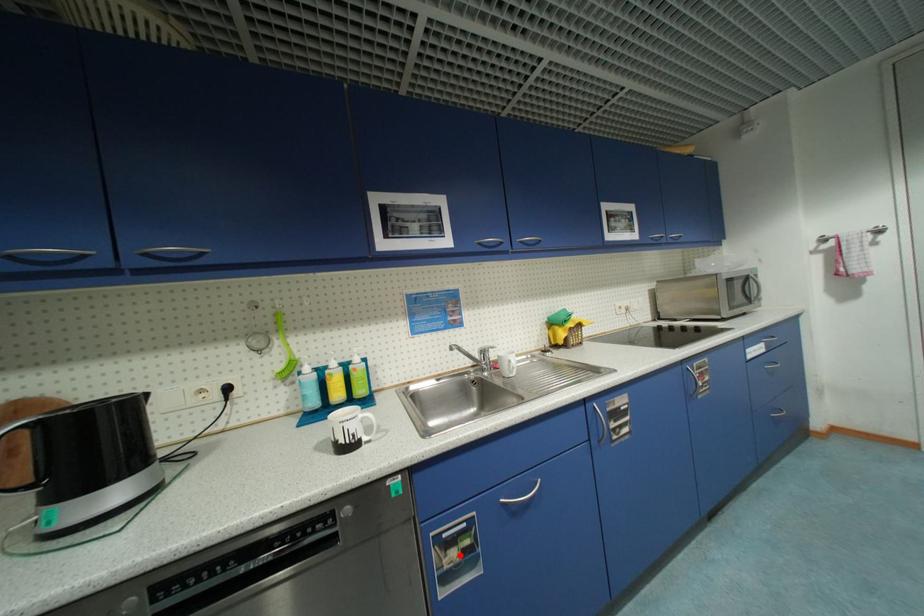
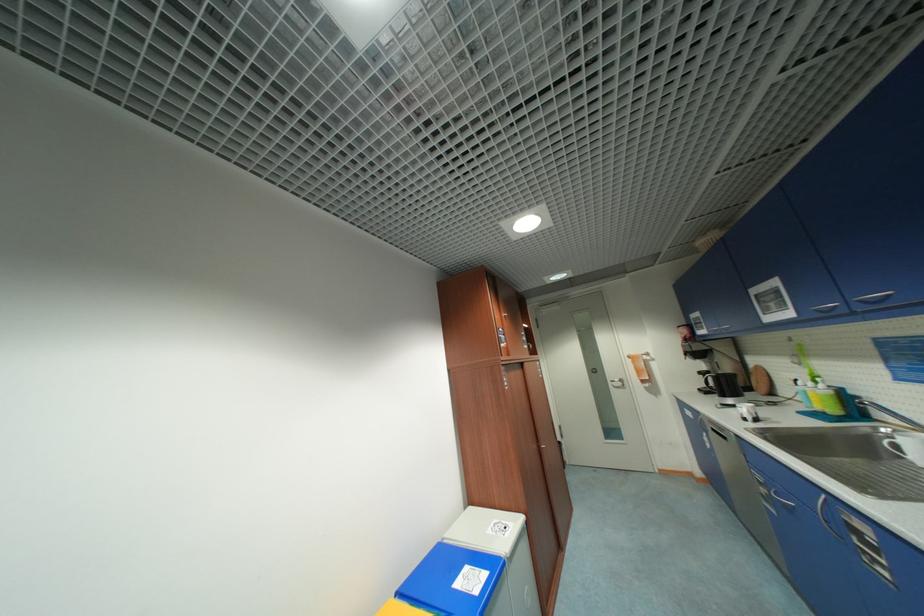
Locate, in the second image, the point that corresponds to the highlighted location in the first image.

(768, 491)